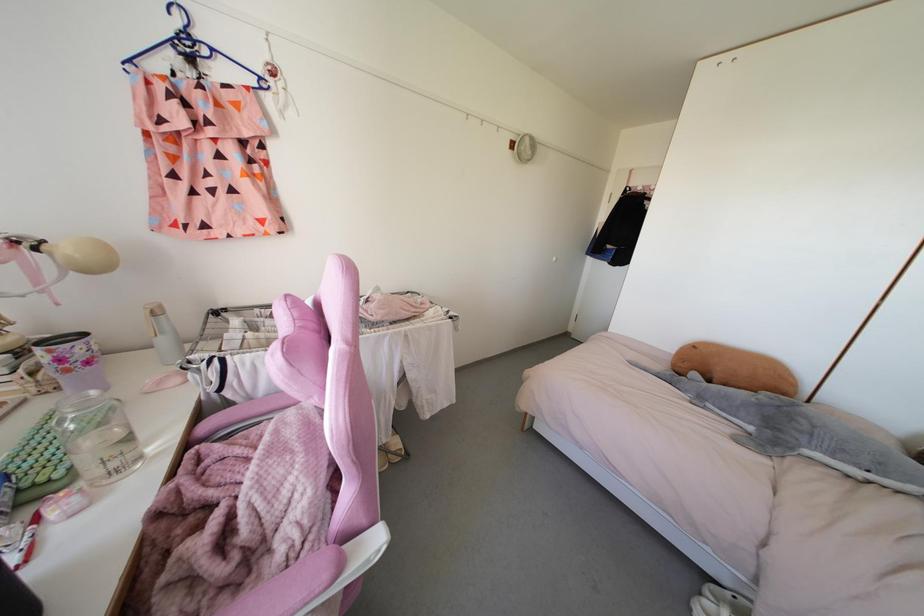
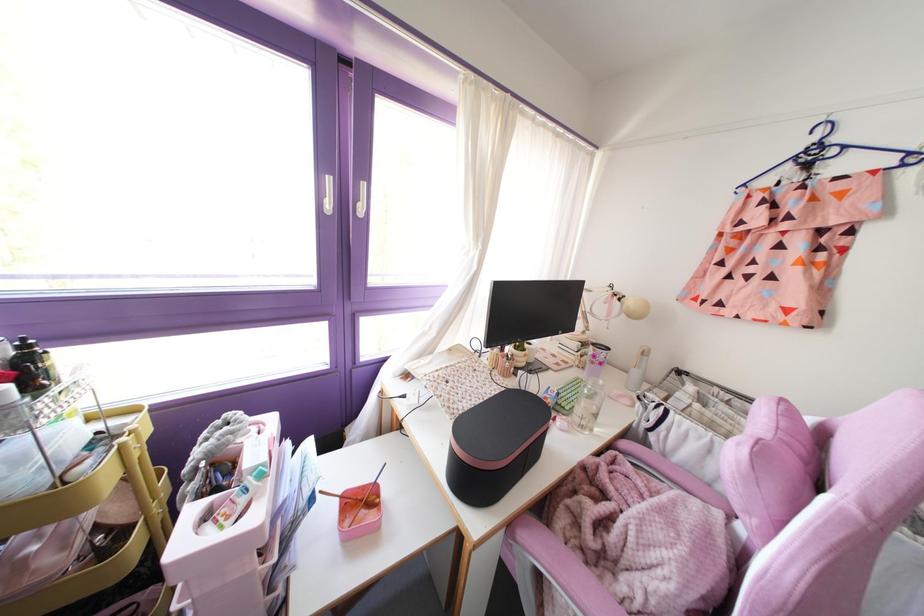
Where in the second image is the point corresponding to point 92,392 from the first image?

(601, 382)